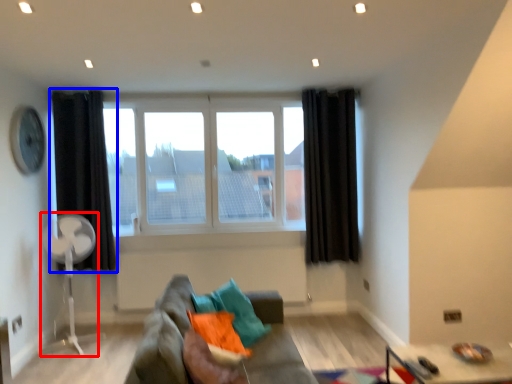
Question: Which point is further to the camera, fan (highlighted by a red box) or curtain (highlighted by a blue box)?

Choices:
 (A) fan
 (B) curtain

Answer: (B)